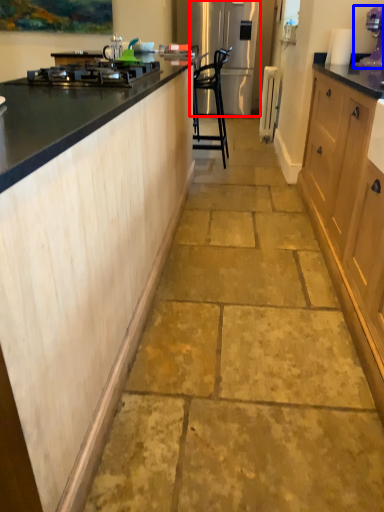
Question: Which object is further to the camera taking this photo, refrigerator (highlighted by a red box) or kitchen appliance (highlighted by a blue box)?

Choices:
 (A) refrigerator
 (B) kitchen appliance

Answer: (A)